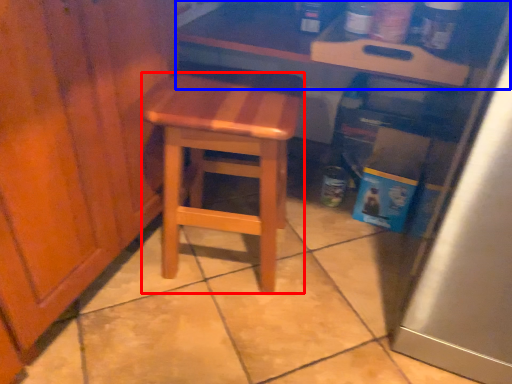
Question: Which of the following is the farthest to the observer, stool (highlighted by a red box) or counter (highlighted by a blue box)?

Choices:
 (A) stool
 (B) counter

Answer: (B)